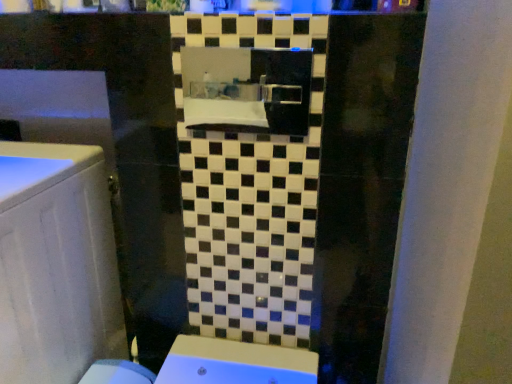
Question: Is satin black mirror at center facing towards white glossy cabinet at left?

Choices:
 (A) no
 (B) yes

Answer: (A)

Question: Can you confirm if satin black mirror at center is smaller than white glossy cabinet at left?

Choices:
 (A) yes
 (B) no

Answer: (A)

Question: Is satin black mirror at center surrounding white glossy cabinet at left?

Choices:
 (A) yes
 (B) no

Answer: (B)

Question: Is the depth of satin black mirror at center greater than that of white glossy cabinet at left?

Choices:
 (A) no
 (B) yes

Answer: (B)

Question: Is satin black mirror at center positioned beyond the bounds of white glossy cabinet at left?

Choices:
 (A) yes
 (B) no

Answer: (A)

Question: Is the surface of satin black mirror at center in direct contact with white glossy cabinet at left?

Choices:
 (A) yes
 (B) no

Answer: (B)

Question: From a real-world perspective, is white glossy cabinet at left beneath satin black mirror at center?

Choices:
 (A) yes
 (B) no

Answer: (A)

Question: Is white glossy cabinet at left in front of satin black mirror at center?

Choices:
 (A) no
 (B) yes

Answer: (B)

Question: Does white glossy cabinet at left appear on the right side of satin black mirror at center?

Choices:
 (A) no
 (B) yes

Answer: (A)

Question: From the image's perspective, is white glossy cabinet at left on top of satin black mirror at center?

Choices:
 (A) no
 (B) yes

Answer: (A)

Question: Is white glossy cabinet at left facing towards satin black mirror at center?

Choices:
 (A) no
 (B) yes

Answer: (A)

Question: Is satin black mirror at center at the back of white glossy cabinet at left?

Choices:
 (A) yes
 (B) no

Answer: (B)

Question: In terms of size, does satin black mirror at center appear bigger or smaller than white glossy cabinet at left?

Choices:
 (A) small
 (B) big

Answer: (A)